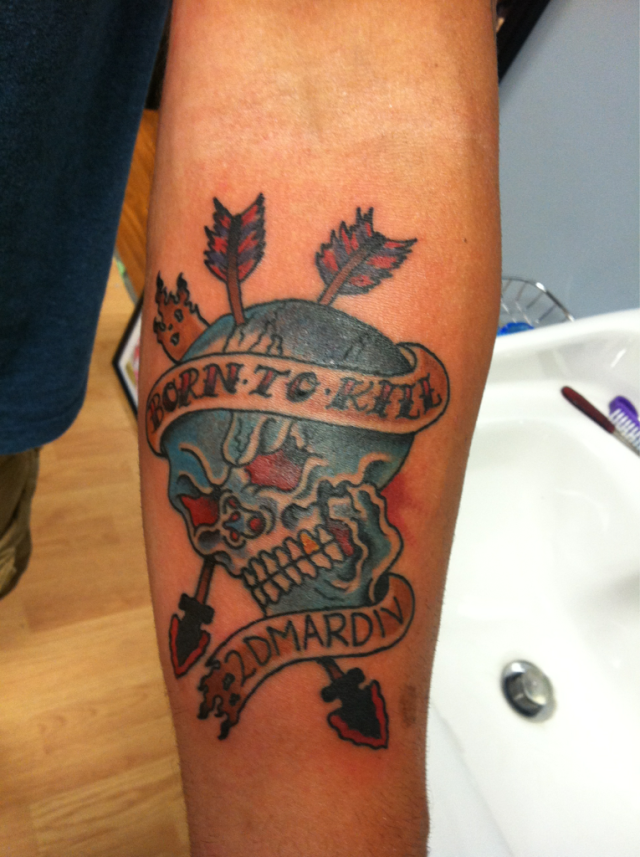
Locate an element on the screen. empty space on the floor is located at coordinates (68, 685).